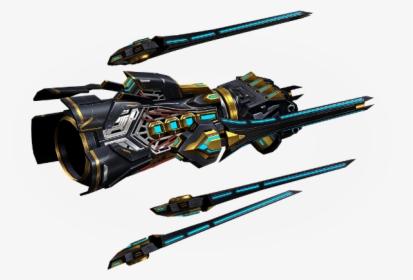
Where is `silver plates`? This screenshot has height=280, width=413. silver plates is located at coordinates (126, 128).